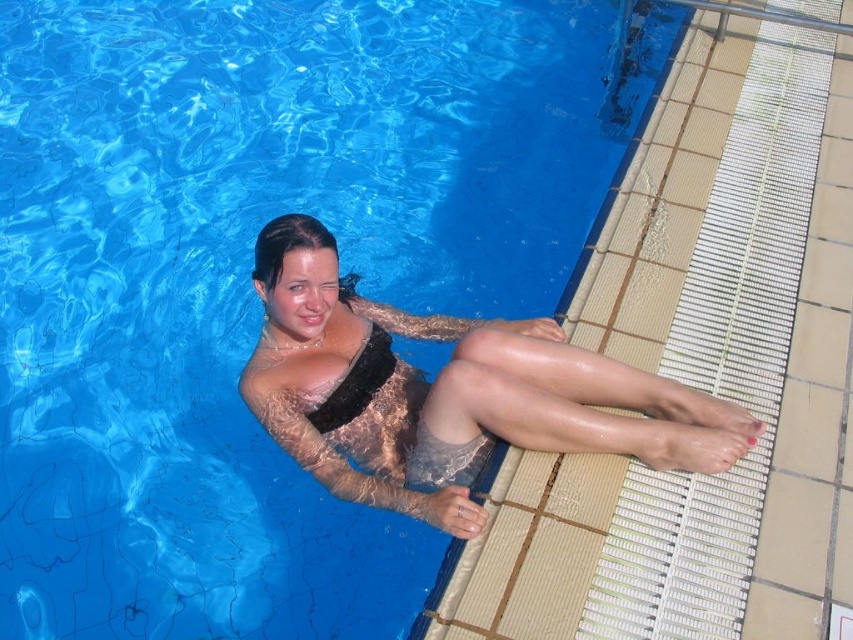
You are a photographer standing at the edge of the swimming pool. You want to take a closeup shot of the lace fabric swimsuit at center. Considering your current position, is the swimsuit within your camera lens range if the minimum focusing distance is 2 meters?

The lace fabric swimsuit at center is 2.76 meters from the camera, which is within the minimum focusing distance of 2 meters. Therefore, the swimsuit can be captured in focus.

You are a photographer trying to capture the lace fabric swimsuit at center and the black fuzzy bikini top at upper center. Which object is closer to the camera based on their positions?

The lace fabric swimsuit at center is closer to the camera because it is in front of the black fuzzy bikini top at upper center.